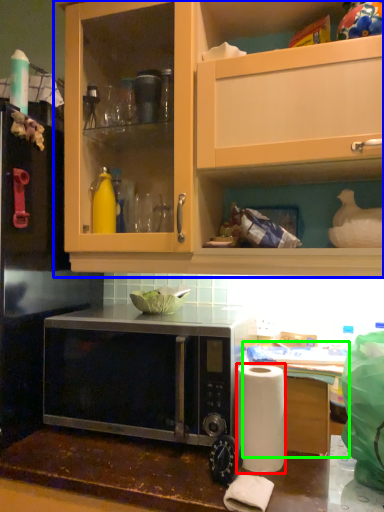
Question: Considering the real-world distances, which object is closest to paper towel (highlighted by a red box)? cabinetry (highlighted by a blue box) or table (highlighted by a green box).

Choices:
 (A) cabinetry
 (B) table

Answer: (B)